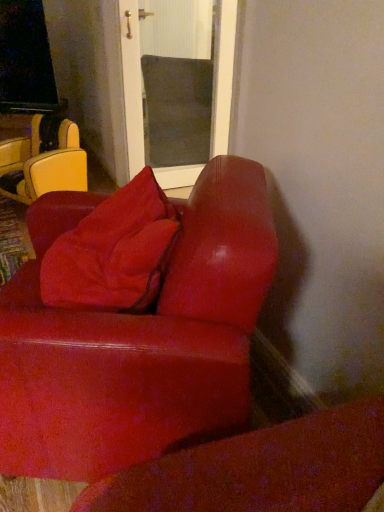
Question: In terms of height, does leather-like yellow chair at left look taller or shorter compared to suede-like red pillow at center?

Choices:
 (A) short
 (B) tall

Answer: (B)

Question: From the image's perspective, relative to suede-like red pillow at center, is leather-like yellow chair at left above or below?

Choices:
 (A) above
 (B) below

Answer: (A)

Question: Which object is the farthest from the suede-like red pillow at center?

Choices:
 (A) leather-like yellow chair at left
 (B) suede-like red couch at lower right

Answer: (A)

Question: Estimate the real-world distances between objects in this image. Which object is closer to the suede-like red couch at lower right?

Choices:
 (A) leather-like yellow chair at left
 (B) suede-like red pillow at center

Answer: (B)